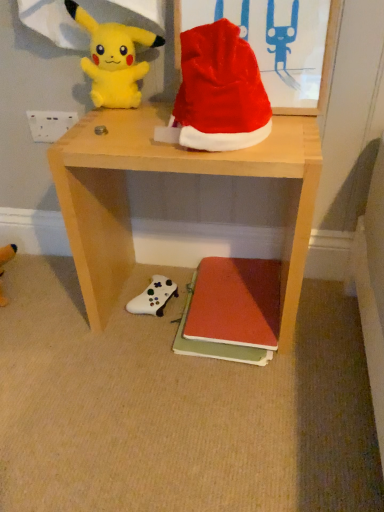
This screenshot has height=512, width=384. What are the coordinates of `free space in front of matte red book at lower center` in the screenshot? It's located at (250, 404).